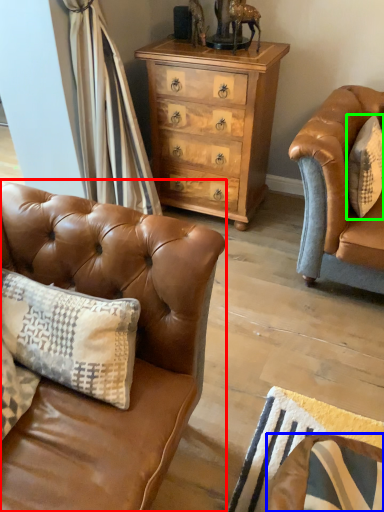
Question: Based on their relative distances, which object is nearer to studio couch (highlighted by a red box)? Choose from swivel chair (highlighted by a blue box) and pillow (highlighted by a green box).

Choices:
 (A) swivel chair
 (B) pillow

Answer: (A)